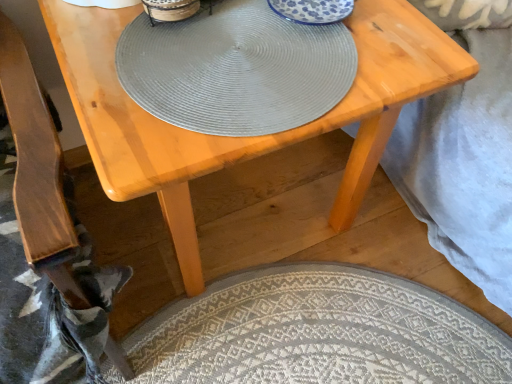
Find the location of a particular element. The height and width of the screenshot is (384, 512). free space in front of matte gray placemat at center is located at coordinates (169, 75).